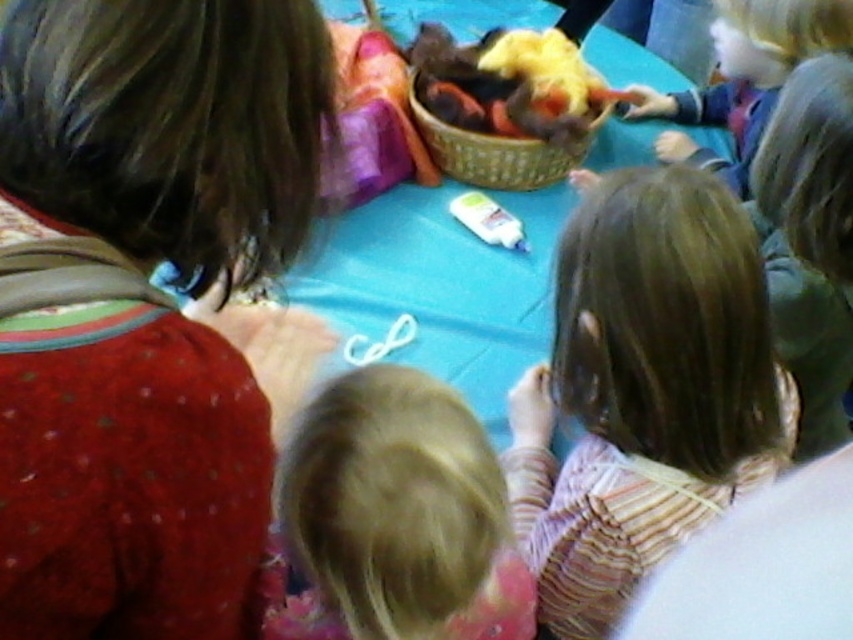
Is light brown hair at center above blue fabric table at center?

Incorrect, light brown hair at center is not positioned above blue fabric table at center.

Which is in front, point (560, 630) or point (360, 349)?

Point (560, 630)

Where is `light brown hair at center`? light brown hair at center is located at coordinates (643, 390).

Can you confirm if blonde hair at center is wider than bright yellow yarn at upper center?

No, blonde hair at center is not wider than bright yellow yarn at upper center.

Is the position of blonde hair at center more distant than that of bright yellow yarn at upper center?

That is False.

Is point (439, 497) farther from viewer compared to point (456, 84)?

No, (439, 497) is in front of (456, 84).

Find the location of `blonde hair at center`. blonde hair at center is located at coordinates (393, 518).

Is the position of blue fabric table at center less distant than that of white glossy glue at center?

Yes, it is.

Which of these two, blue fabric table at center or white glossy glue at center, stands taller?

blue fabric table at center

Does point (508, 17) lie behind point (474, 234)?

That is True.

I want to click on blue fabric table at center, so click(439, 285).